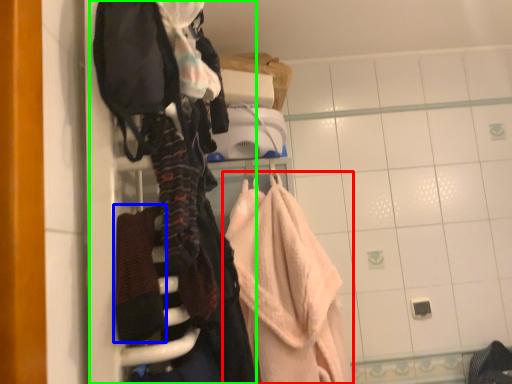
Question: Considering the real-world distances, which object is farthest from towel (highlighted by a red box)? bath towel (highlighted by a blue box) or closet (highlighted by a green box)?

Choices:
 (A) bath towel
 (B) closet

Answer: (A)